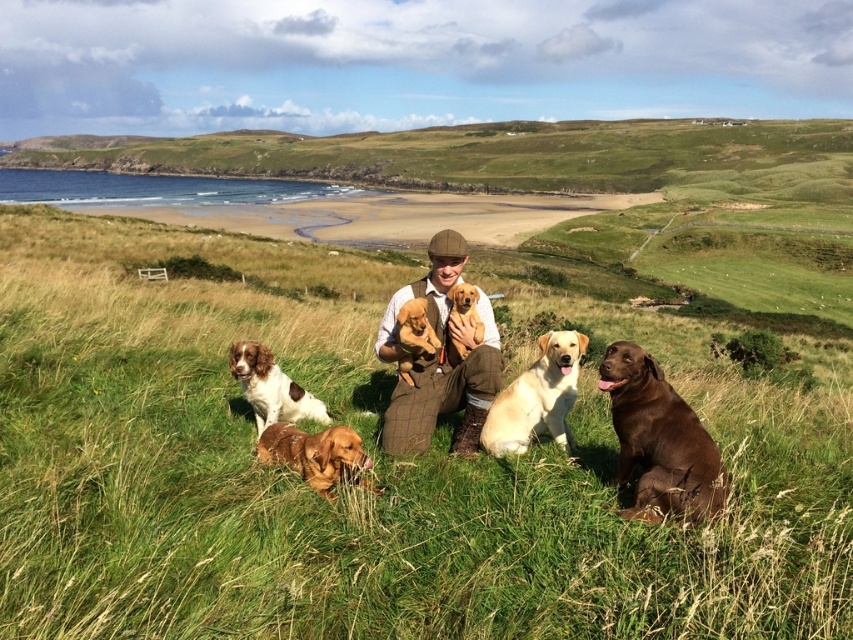
Question: Which of these objects is positioned farthest from the green grassy hillside at upper center?

Choices:
 (A) brown speckled fur dog at lower left
 (B) light yellow fur at center
 (C) brown furry dog at lower right
 (D) golden fur puppies at center

Answer: (B)

Question: Can you confirm if green grassy at center is thinner than brown tweed suit at center?

Choices:
 (A) no
 (B) yes

Answer: (A)

Question: Estimate the real-world distances between objects in this image. Which object is farther from the golden brown fur at center?

Choices:
 (A) green grassy hillside at upper center
 (B) brown furry dog at lower right

Answer: (A)

Question: Does brown furry dog at lower right have a lesser width compared to brown speckled fur dog at lower left?

Choices:
 (A) yes
 (B) no

Answer: (B)

Question: Can you confirm if brown tweed suit at center is wider than brown speckled fur dog at lower left?

Choices:
 (A) yes
 (B) no

Answer: (A)

Question: Which of the following is the farthest from the observer?

Choices:
 (A) golden brown fur at center
 (B) light yellow fur at center
 (C) brown furry dog at lower right

Answer: (B)